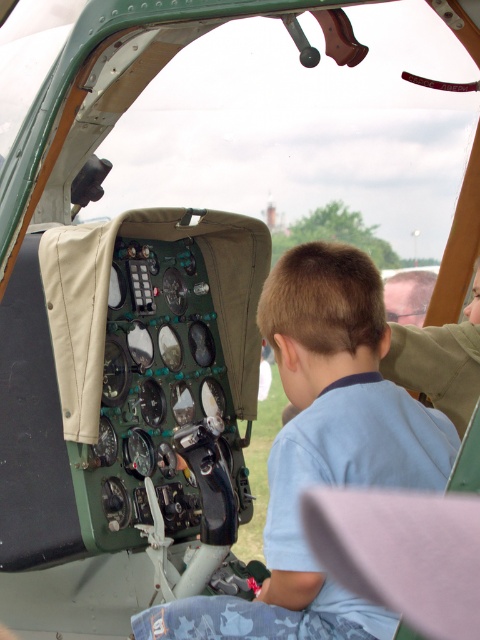
Question: Which point appears closest to the camera in this image?

Choices:
 (A) (431, 387)
 (B) (332, 589)

Answer: (B)

Question: Is light blue shirt at center behind light brown leather hand at upper right?

Choices:
 (A) no
 (B) yes

Answer: (A)

Question: Is light blue shirt at center wider than light brown leather hand at upper right?

Choices:
 (A) yes
 (B) no

Answer: (A)

Question: Can you confirm if light blue shirt at center is positioned below light brown leather hand at upper right?

Choices:
 (A) yes
 (B) no

Answer: (A)

Question: Which object is closer to the camera taking this photo?

Choices:
 (A) light blue shirt at center
 (B) light brown leather hand at upper right

Answer: (A)

Question: Which point is farther from the camera taking this photo?

Choices:
 (A) (335, 470)
 (B) (460, 420)

Answer: (B)